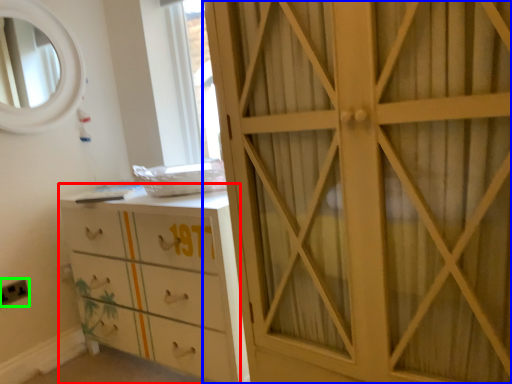
Question: Which object is the farthest from chest of drawers (highlighted by a red box)? Choose among these: cupboard (highlighted by a blue box) or electric outlet (highlighted by a green box).

Choices:
 (A) cupboard
 (B) electric outlet

Answer: (B)